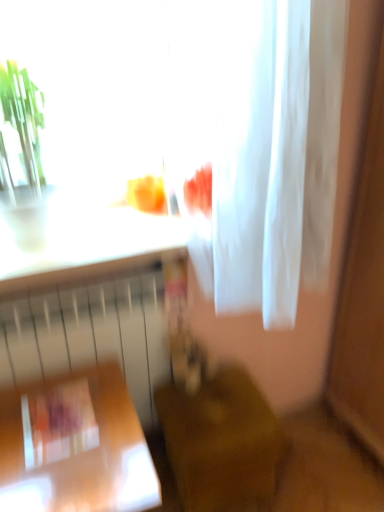
Locate an element on the screen. vacant area on the back side of matte plastic book at lower left is located at coordinates (79, 373).